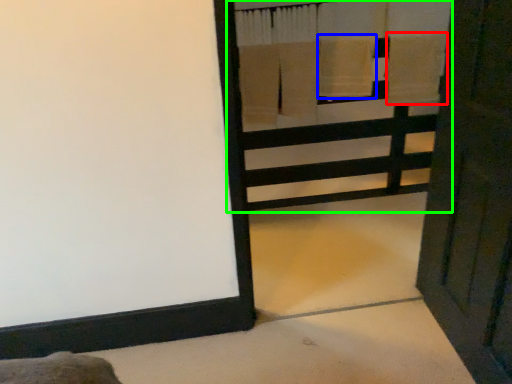
Question: Estimate the real-world distances between objects in this image. Which object is farther from bath towel (highlighted by a red box), bath towel (highlighted by a blue box) or bunk bed (highlighted by a green box)?

Choices:
 (A) bath towel
 (B) bunk bed

Answer: (B)